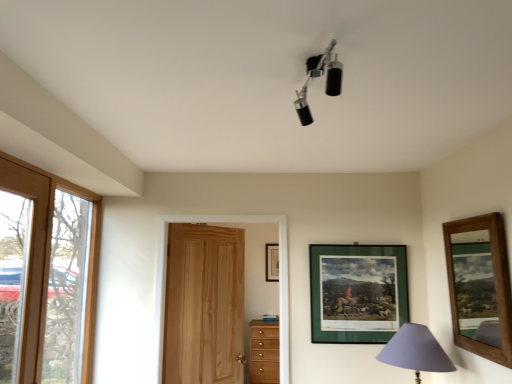
Question: Is wooden framed mirror at right, which ranks as the 3th picture frame in back-to-front order, closer to camera compared to purple fabric lampshade at lower right, the 2th lamp from the left?

Choices:
 (A) no
 (B) yes

Answer: (B)

Question: Is wooden framed mirror at right, which appears as the third picture frame when viewed from the left, completely or partially outside of purple fabric lampshade at lower right, which is the first lamp from back to front?

Choices:
 (A) yes
 (B) no

Answer: (A)

Question: Considering the relative sizes of wooden framed mirror at right, the 1th picture frame in the right-to-left sequence, and purple fabric lampshade at lower right, acting as the first lamp starting from the right, in the image provided, is wooden framed mirror at right, the 1th picture frame in the right-to-left sequence, wider than purple fabric lampshade at lower right, acting as the first lamp starting from the right,?

Choices:
 (A) no
 (B) yes

Answer: (A)

Question: Is wooden framed mirror at right, the 1th picture frame in the right-to-left sequence, placed right next to purple fabric lampshade at lower right, the 2th lamp from the left?

Choices:
 (A) no
 (B) yes

Answer: (A)

Question: Could purple fabric lampshade at lower right, the 2th lamp from the left, be considered to be inside wooden framed mirror at right, which appears as the third picture frame when viewed from the left?

Choices:
 (A) no
 (B) yes

Answer: (A)

Question: From a real-world perspective, does wooden framed mirror at right, marked as the 1th picture frame in a front-to-back arrangement, stand above purple fabric lampshade at lower right, acting as the first lamp starting from the right?

Choices:
 (A) yes
 (B) no

Answer: (A)

Question: From a real-world perspective, is black matte spotlights at upper center, which appears as the 2th lamp when ordered from the bottom, located beneath purple fabric lampshade at lower right, the first lamp positioned from the bottom?

Choices:
 (A) yes
 (B) no

Answer: (B)

Question: Can you confirm if black matte spotlights at upper center, which appears as the 2th lamp when ordered from the bottom, is taller than purple fabric lampshade at lower right, the 2th lamp from the left?

Choices:
 (A) no
 (B) yes

Answer: (A)

Question: Does black matte spotlights at upper center, the 2th lamp from the right, come in front of purple fabric lampshade at lower right, the 2th lamp from the left?

Choices:
 (A) yes
 (B) no

Answer: (A)

Question: Does black matte spotlights at upper center, which appears as the 1th lamp when viewed from the front, have a smaller size compared to purple fabric lampshade at lower right, acting as the first lamp starting from the right?

Choices:
 (A) yes
 (B) no

Answer: (A)

Question: Can you confirm if black matte spotlights at upper center, which appears as the 1th lamp when viewed from the front, is positioned to the right of purple fabric lampshade at lower right, the first lamp positioned from the bottom?

Choices:
 (A) yes
 (B) no

Answer: (B)

Question: Does black matte spotlights at upper center, which appears as the 2th lamp when ordered from the bottom, have a greater width compared to purple fabric lampshade at lower right, acting as the 2th lamp starting from the front?

Choices:
 (A) no
 (B) yes

Answer: (A)

Question: Does purple fabric lampshade at lower right, the 2th lamp from the left, have a greater width compared to natural wood door at center?

Choices:
 (A) no
 (B) yes

Answer: (B)